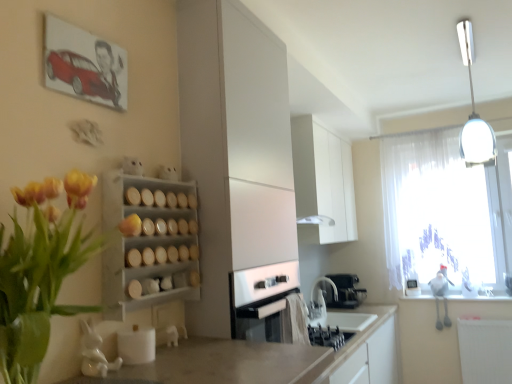
Question: Is black matte coffee machine at lower center shorter than white glossy cabinet at upper center, which is the 2th cabinetry in front-to-back order?

Choices:
 (A) yes
 (B) no

Answer: (A)

Question: Could you tell me if black matte coffee machine at lower center is turned towards white glossy cabinet at upper center, which appears as the 1th cabinetry when viewed from the right?

Choices:
 (A) no
 (B) yes

Answer: (A)

Question: From a real-world perspective, is black matte coffee machine at lower center positioned over white glossy cabinet at upper center, which appears as the 1th cabinetry when viewed from the right, based on gravity?

Choices:
 (A) yes
 (B) no

Answer: (B)

Question: Does black matte coffee machine at lower center appear on the right side of white glossy cabinet at upper center, which appears as the 1th cabinetry when viewed from the right?

Choices:
 (A) no
 (B) yes

Answer: (B)

Question: Can you confirm if black matte coffee machine at lower center is wider than white glossy cabinet at upper center, positioned as the first cabinetry in back-to-front order?

Choices:
 (A) no
 (B) yes

Answer: (B)

Question: From the image's perspective, is white matte radiator at lower right above or below black matte coffee machine at lower center?

Choices:
 (A) above
 (B) below

Answer: (B)

Question: Considering the positions of white matte radiator at lower right and black matte coffee machine at lower center in the image, is white matte radiator at lower right bigger or smaller than black matte coffee machine at lower center?

Choices:
 (A) big
 (B) small

Answer: (A)

Question: Considering their positions, is white matte radiator at lower right located in front of or behind black matte coffee machine at lower center?

Choices:
 (A) behind
 (B) front

Answer: (B)

Question: In the image, is white matte radiator at lower right on the left side or the right side of black matte coffee machine at lower center?

Choices:
 (A) left
 (B) right

Answer: (B)

Question: Is point (32, 322) closer or farther from the camera than point (437, 256)?

Choices:
 (A) closer
 (B) farther

Answer: (A)

Question: Is yellow tulip bouquet at left bigger or smaller than transparent fabric at upper right?

Choices:
 (A) big
 (B) small

Answer: (B)

Question: From a real-world perspective, relative to transparent fabric at upper right, is yellow tulip bouquet at left vertically above or below?

Choices:
 (A) above
 (B) below

Answer: (B)

Question: Considering the positions of yellow tulip bouquet at left and transparent fabric at upper right in the image, is yellow tulip bouquet at left wider or thinner than transparent fabric at upper right?

Choices:
 (A) thin
 (B) wide

Answer: (B)

Question: Considering the positions of yellow tulip bouquet at left and white matte cabinet at center, placed as the 2th cabinetry when sorted from back to front, in the image, is yellow tulip bouquet at left taller or shorter than white matte cabinet at center, placed as the 2th cabinetry when sorted from back to front,?

Choices:
 (A) short
 (B) tall

Answer: (A)

Question: From the image's perspective, relative to white matte cabinet at center, placed as the 2th cabinetry when sorted from back to front, is yellow tulip bouquet at left above or below?

Choices:
 (A) above
 (B) below

Answer: (B)